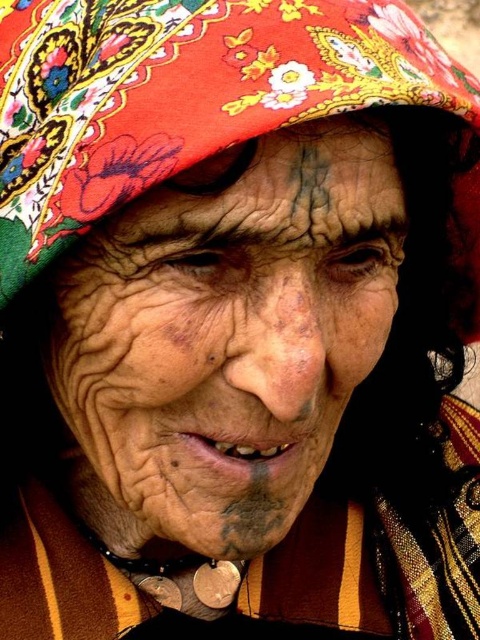
Based on the scene description, can you tell which object, the floral fabric headdress at upper center or the striped woolen robe at lower center, is taller?

The floral fabric headdress at upper center is taller than the striped woolen robe at lower center according to the description.

You are taking a photo of the elderly person and want to focus on both the point at point (9, 147) and the point at point (336, 168). Which point is closer to the camera?

Point (9, 147) is further to the camera than point (336, 168), so the point at point (336, 168) is closer to the camera.